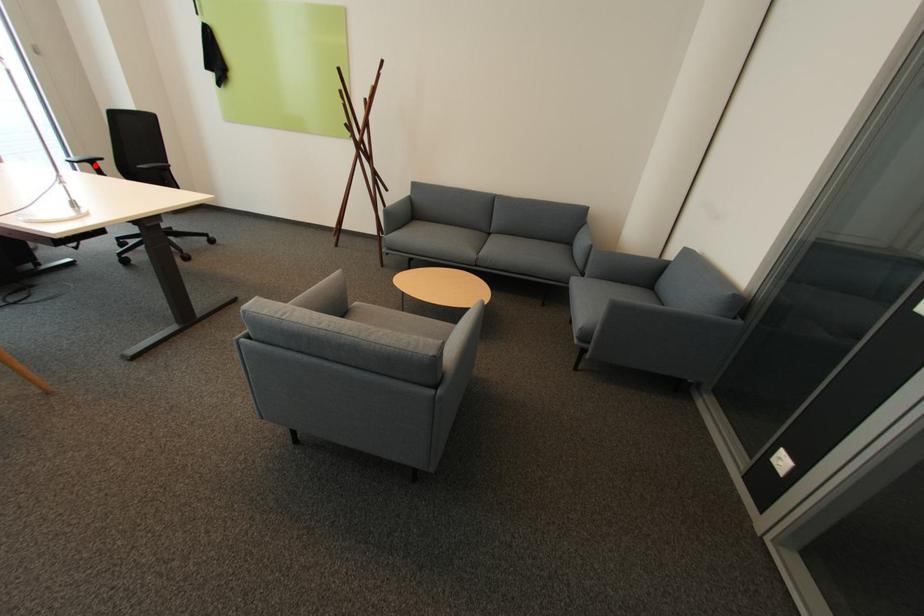
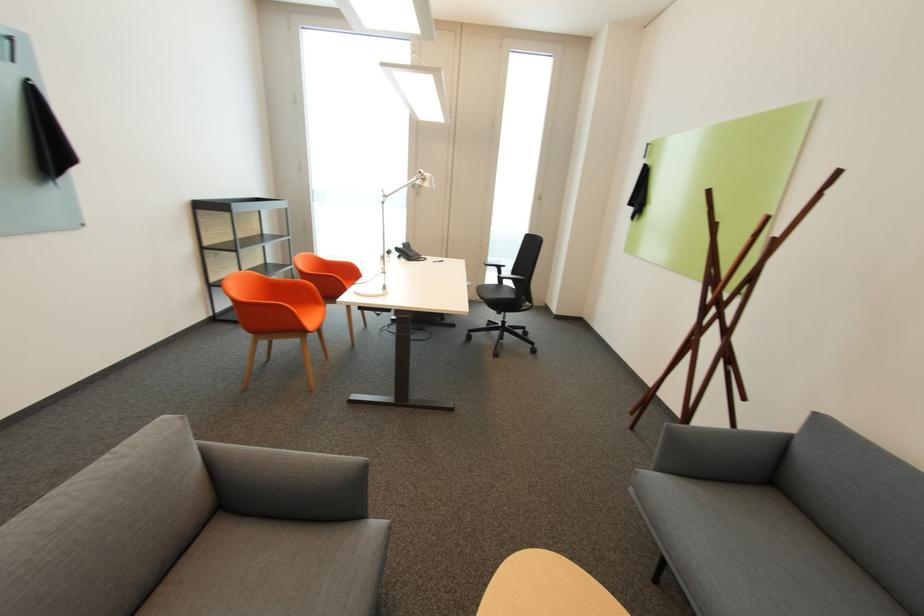
Question: I am providing you with two images of the same scene from different viewpoints. Image1 has a red point marked. In image2, the corresponding 3D location appears at what relative position? Reply with the corresponding letter.

Choices:
 (A) Closer
 (B) Farther

Answer: (A)